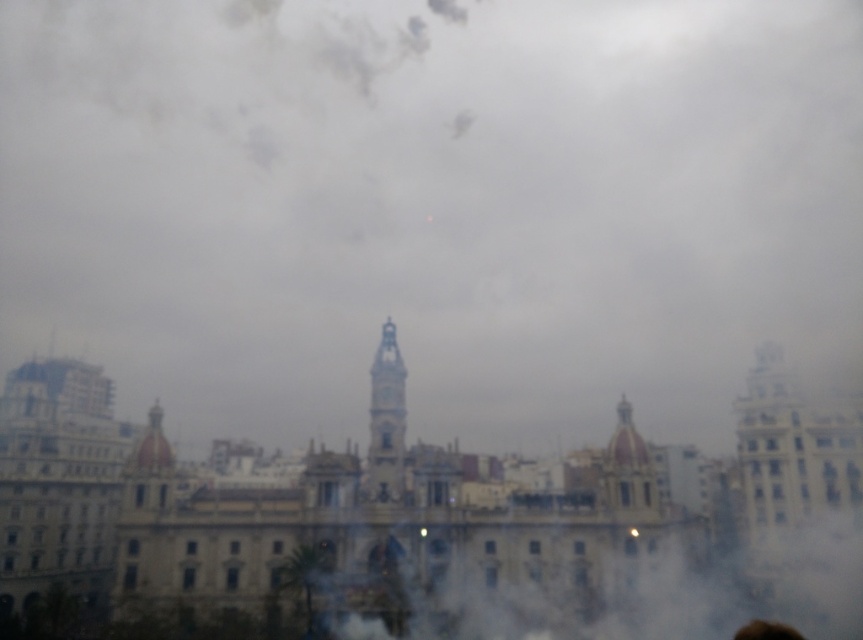
You are looking at the cityscape through a window and notice two points marked on the image. The first point is at coordinates point (408, 252) and the second is at point (745, 632). Which point is closer to you?

Point (408, 252) is further to the viewer than point (745, 632), so the point closer to you is point (745, 632).

You are an architect designing a new building in the city. You want to ensure that the new building doesn not block the view of the white cotton cloud at upper center from the window where the brown hair at upper center is visible. Given their positions, what should you consider about the building height?

The white cotton cloud at upper center is much taller than the brown hair at upper center. To ensure the view of the white cotton cloud at upper center remains unobstructed from the window with the brown hair at upper center, the new building should be constructed at a height lower than the vertical distance between the two objects.

You are looking through a window at a city scene. You notice a white cotton cloud at upper center and brown hair at upper center. Which object is wider?

The white cotton cloud at upper center is wider than the brown hair at upper center.